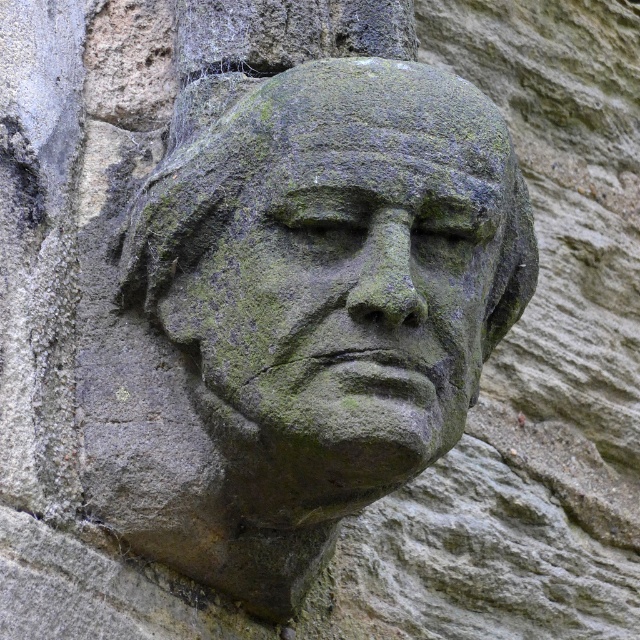
You are an archaeologist examining a wall with coordinates marked. You need to locate the green mossy stone head at center. What are the coordinates where you should look?

The green mossy stone head at center is located at coordinates point (337,275).

In the scene shown: You are an art conservator examining the sculpture. You notice two areas of green moss growth on the stone surface. One is labeled as the green mossy stone head at center and the other as the green mossy stone face at center. Which of these two areas is positioned higher up on the sculpture?

The green mossy stone head at center is positioned higher up on the sculpture than the green mossy stone face at center.

You are an art conservator examining the stone sculpture. You notice two areas covered in green mossy growth. One is labeled as the green mossy stone head at center and the other as the green mossy stone face at center. Based on their sizes, which area might require more immediate attention for conservation due to potential structural vulnerability?

The green mossy stone head at center is taller than the green mossy stone face at center. Since larger areas with moss may have deeper penetration into the stone, the green mossy stone head at center likely requires more immediate attention for conservation.